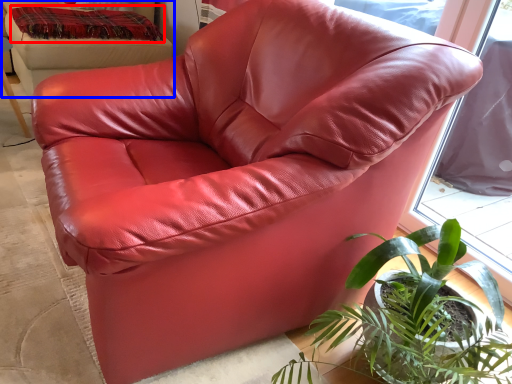
Question: Among these objects, which one is nearest to the camera, blanket (highlighted by a red box) or bean bag chair (highlighted by a blue box)?

Choices:
 (A) blanket
 (B) bean bag chair

Answer: (B)